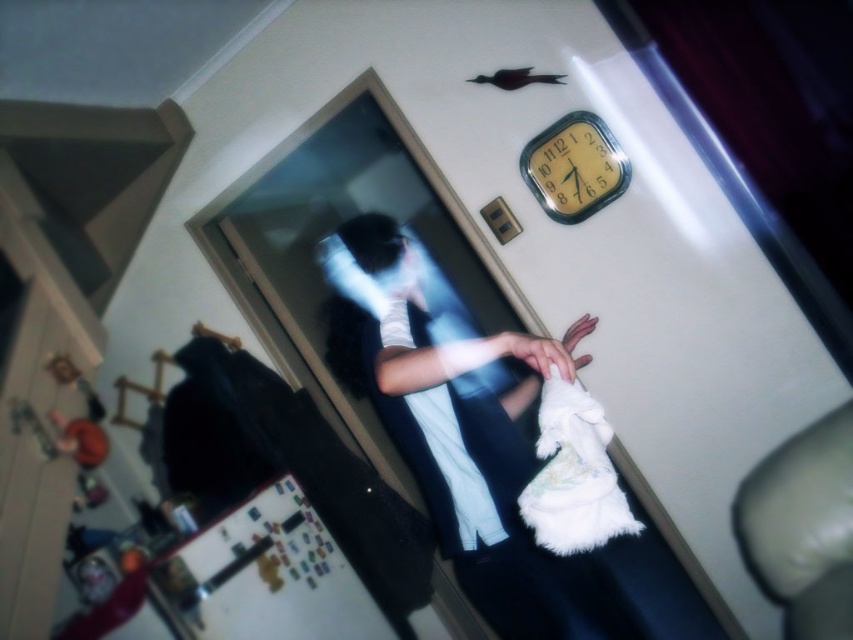
You are standing in the hallway and see the white fluffy towel at center and the yellow matte clock at upper center. Which object is taller?

The white fluffy towel at center is taller than the yellow matte clock at upper center according to the description.

You are holding a 1.2 meter long pole and want to reach the white fluffy towel at center from where you are standing. Can you reach it with the pole?

The white fluffy towel at center is 1.23 meters from viewer. Since the pole is 1.2 meters long, you cannot reach it as the distance is slightly longer than the pole.

You are a guest in this house and need to find a towel. You see the white fluffy towel at center and the yellow matte clock at upper center. Which object is bigger?

The white fluffy towel at center is larger in size than the yellow matte clock at upper center.